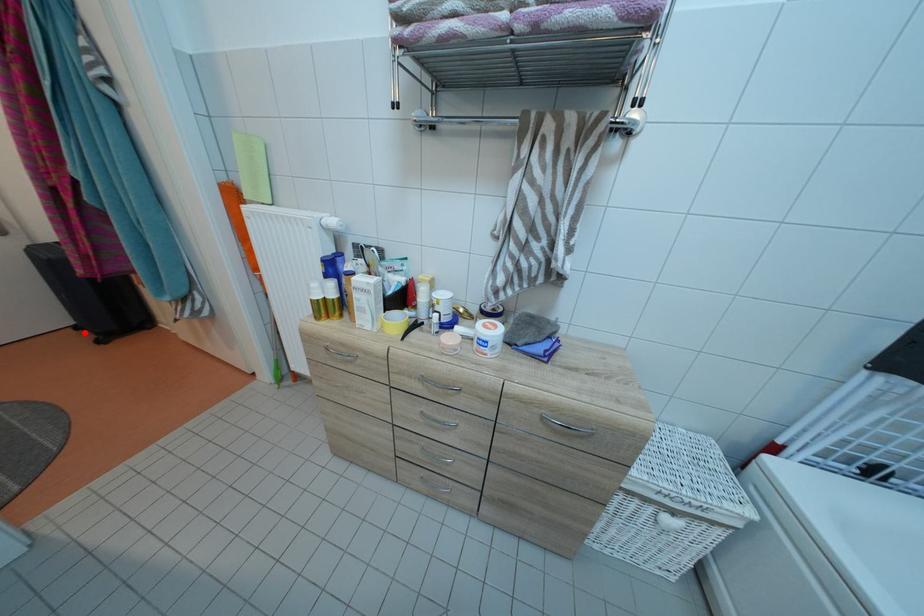
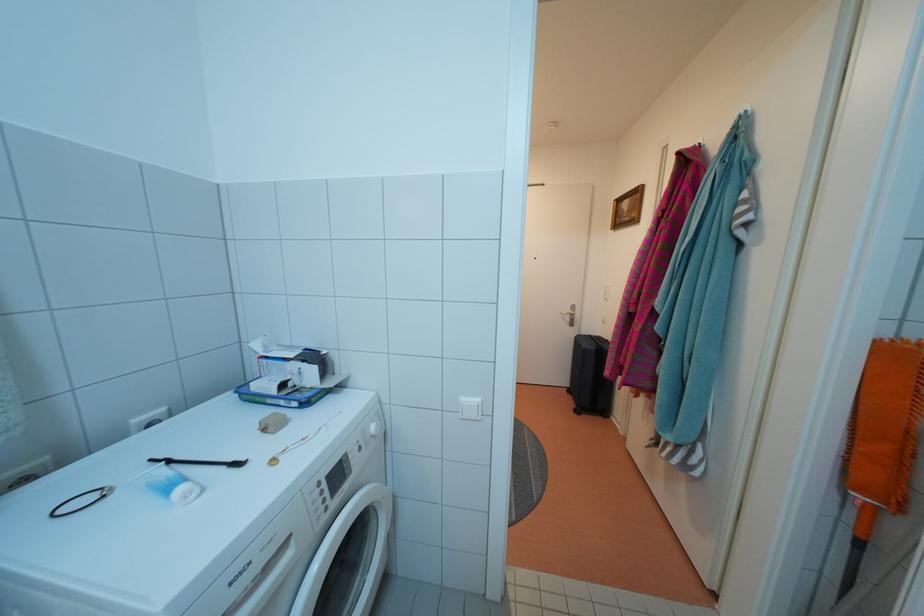
Question: I am providing you with two images of the same scene from different viewpoints. Given a red point in image1, look at the same physical point in image2. Is it:

Choices:
 (A) Closer to the viewpoint
 (B) Farther from the viewpoint

Answer: (A)